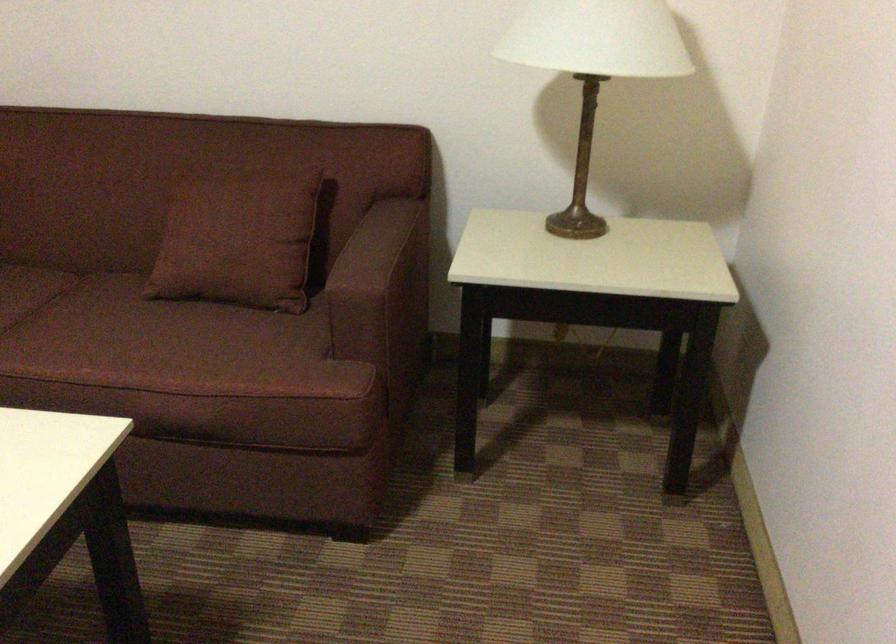
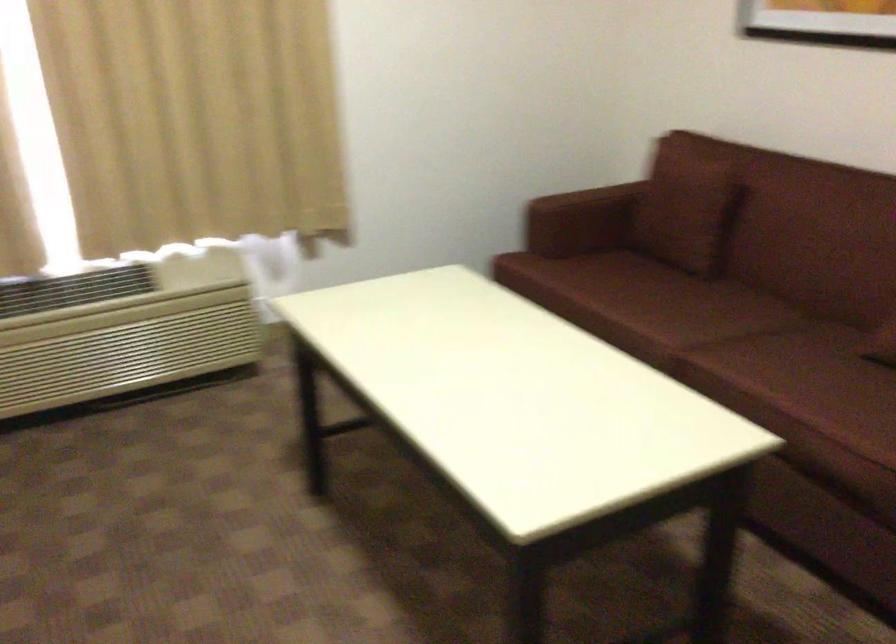
Question: The first image is from the beginning of the video and the second image is from the end. How did the camera likely rotate when shooting the video?

Choices:
 (A) Left
 (B) Right
 (C) Up
 (D) Down

Answer: (A)